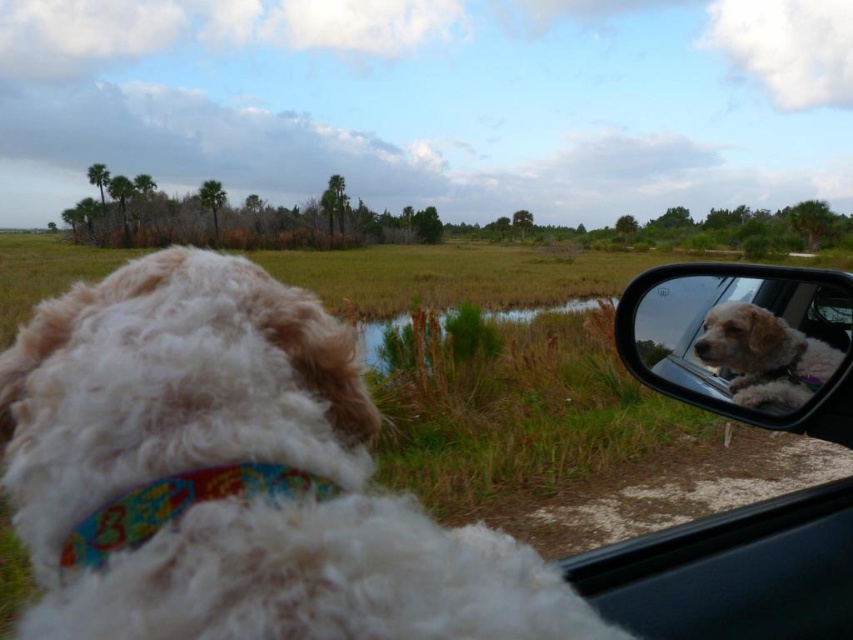
You are sitting in the driver seat of the car and want to check if the white fluffy dog at left is positioned in the left third of the image. According to the coordinate system where the bottom left corner is 0,0 and the top right corner is 1,1, can you confirm this?

The position of white fluffy dog at left is at point (234, 476). Since the x coordinate is 0.745 which is more than 0.333, it is not in the left third of the image.

You are sitting in the car and see the white fluffy dog at left and the multicolored fabric neckband at lower left. Which object is closer to the left side of the car window?

The white fluffy dog at left is closer to the left side of the car window because it is positioned to the left of the multicolored fabric neckband at lower left.

You are sitting in the car and want to know which of the two points, point (247, 454) or point (786, 401), is closer to you. Based on the scene, can you determine which one is nearer?

Point (247, 454) is closer to the camera than point (786, 401), so it is the nearer one.